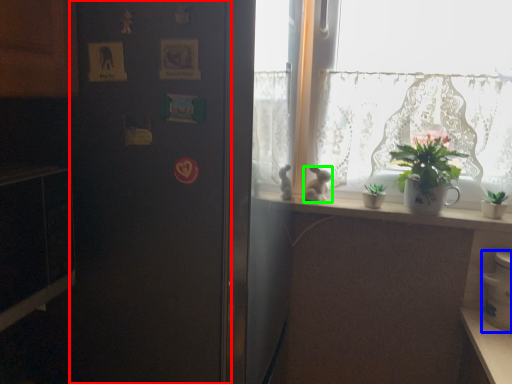
Question: Estimate the real-world distances between objects in this image. Which object is closer to screen door (highlighted by a red box), appliance (highlighted by a blue box) or rabbit (highlighted by a green box)?

Choices:
 (A) appliance
 (B) rabbit

Answer: (B)